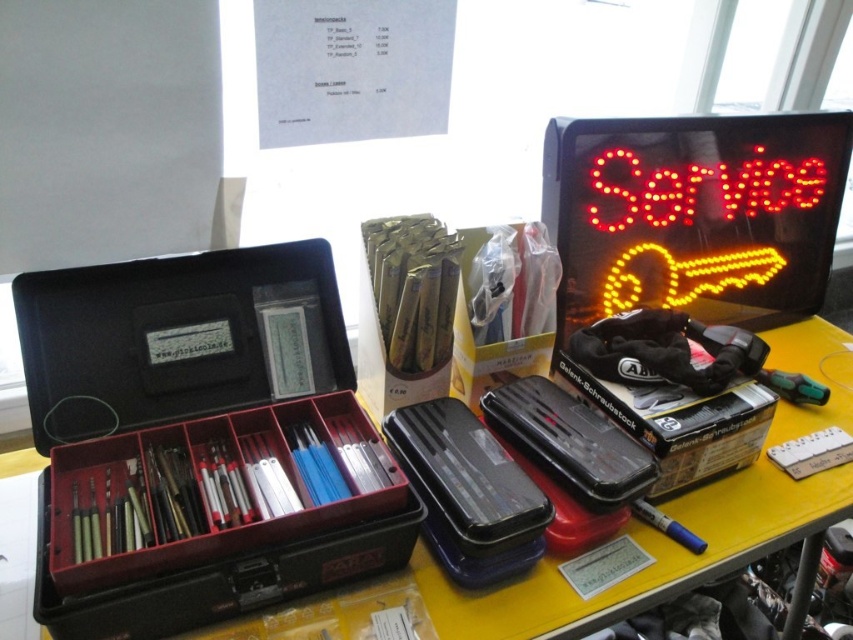
Question: Which point is farther to the camera?

Choices:
 (A) (194, 435)
 (B) (712, 524)

Answer: (B)

Question: Which of the following is the closest to the observer?

Choices:
 (A) (177, 310)
 (B) (804, 340)

Answer: (A)

Question: Is black plastic toolbox at center to the right of yellow matte table at center from the viewer's perspective?

Choices:
 (A) yes
 (B) no

Answer: (B)

Question: Can you confirm if black plastic toolbox at center is smaller than yellow matte table at center?

Choices:
 (A) yes
 (B) no

Answer: (A)

Question: Where is black plastic toolbox at center located in relation to yellow matte table at center in the image?

Choices:
 (A) right
 (B) left

Answer: (B)